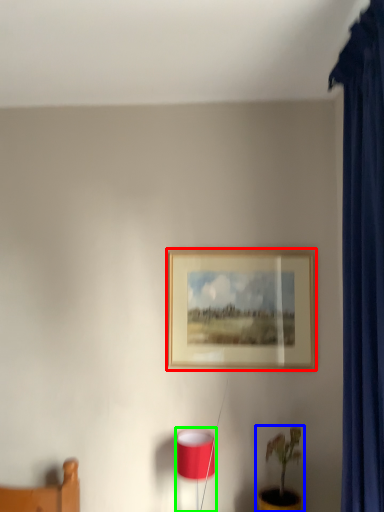
Question: Considering the real-world distances, which object is farthest from picture frame (highlighted by a red box)? houseplant (highlighted by a blue box) or table lamp (highlighted by a green box)?

Choices:
 (A) houseplant
 (B) table lamp

Answer: (A)